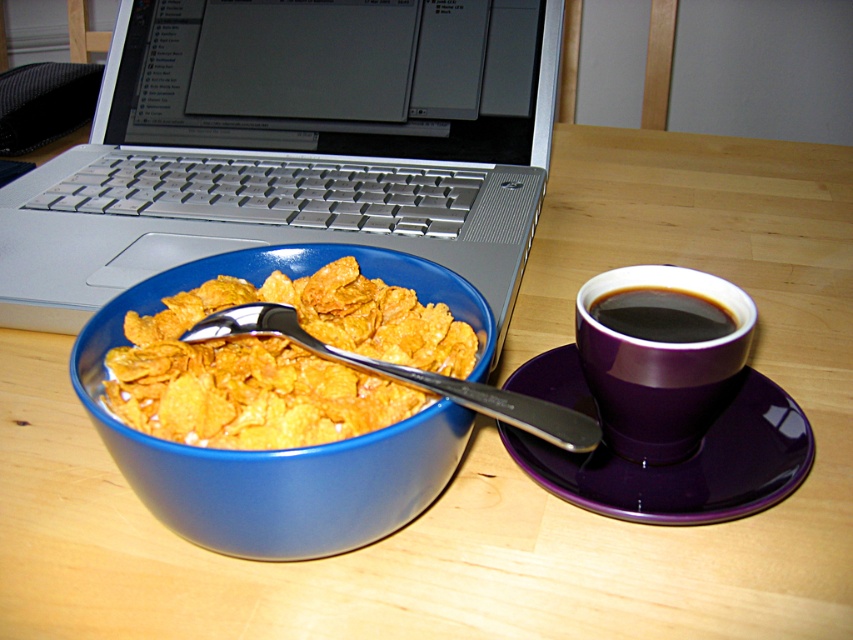
Which is in front, point (351, 545) or point (256, 328)?

Point (351, 545) is more forward.

Between blue glossy bowl at center and silver metallic spoon at bowl center, which one is positioned higher?

Positioned higher is silver metallic spoon at bowl center.

Where is `blue glossy bowl at center`? The height and width of the screenshot is (640, 853). blue glossy bowl at center is located at coordinates (287, 451).

Based on the photo, between blue glossy bowl at center and black glossy cup at right, which one is positioned higher?

black glossy cup at right is above.

Which is below, blue glossy bowl at center or black glossy cup at right?

blue glossy bowl at center is lower down.

Is point (450, 472) positioned behind point (721, 314)?

No, (450, 472) is closer to viewer.

The image size is (853, 640). In order to click on blue glossy bowl at center in this screenshot , I will do `click(287, 451)`.

Find the location of a particular element. The height and width of the screenshot is (640, 853). silver metallic laptop at upper left is located at coordinates (293, 145).

Between silver metallic laptop at upper left and black glossy cup at right, which one is positioned higher?

silver metallic laptop at upper left is higher up.

Find the location of `silver metallic laptop at upper left`. silver metallic laptop at upper left is located at coordinates (293, 145).